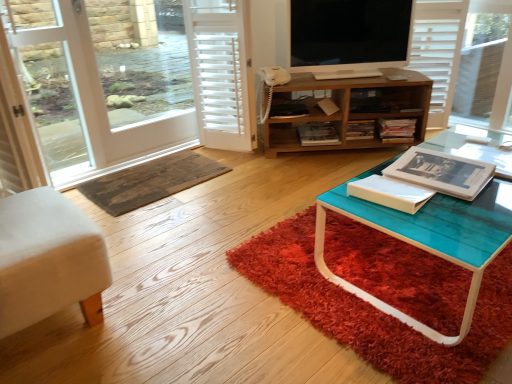
The width and height of the screenshot is (512, 384). Identify the location of vacant space that's between white fabric cushion at lower left and shaggy red rug at lower center, marked as the first doormat in a front-to-back arrangement. (206, 294).